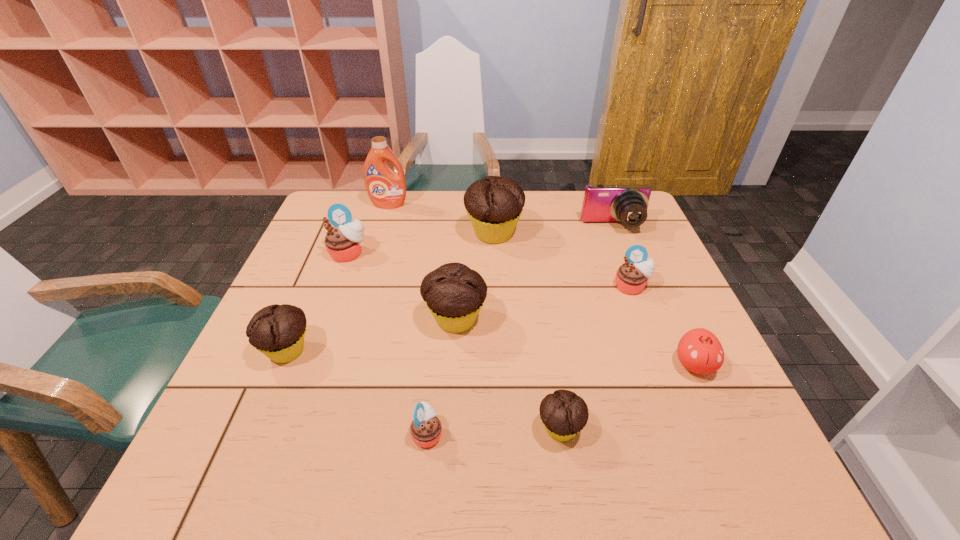
Where is `free space that satisfies the following two spatial constraints: 1. on the front-facing side of the red apple; 2. on the right side of the farthest pink muffin`? Image resolution: width=960 pixels, height=540 pixels. free space that satisfies the following two spatial constraints: 1. on the front-facing side of the red apple; 2. on the right side of the farthest pink muffin is located at coordinates (308, 365).